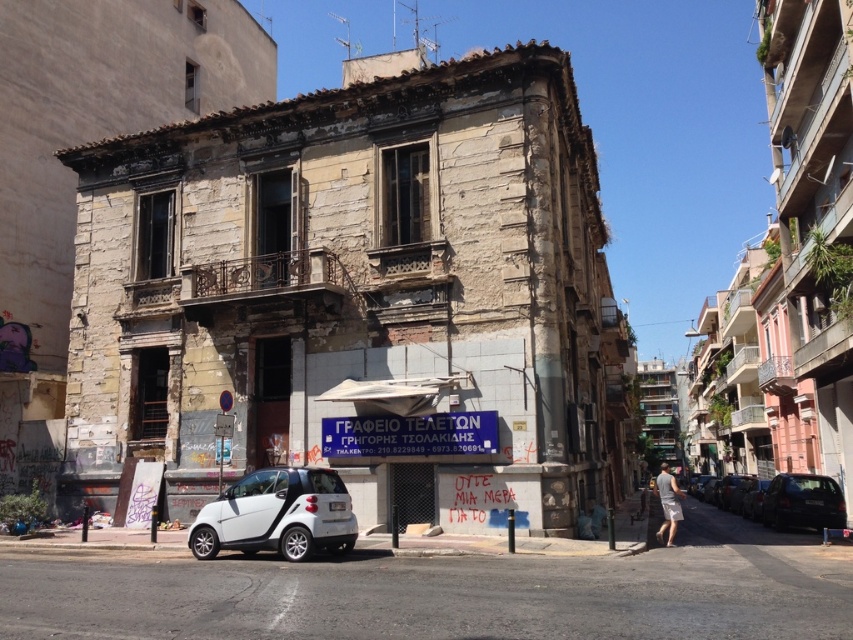
Question: Can you confirm if white matte car at center is positioned to the right of dark gray metallic car at right?

Choices:
 (A) yes
 (B) no

Answer: (B)

Question: Which of the following is the farthest from the observer?

Choices:
 (A) (822, 500)
 (B) (280, 509)

Answer: (A)

Question: Which object appears farthest from the camera in this image?

Choices:
 (A) white matte car at center
 (B) dark gray metallic car at right

Answer: (B)

Question: Is white matte car at center bigger than dark gray metallic car at right?

Choices:
 (A) no
 (B) yes

Answer: (A)

Question: Is white matte car at center to the left of dark gray metallic car at right from the viewer's perspective?

Choices:
 (A) yes
 (B) no

Answer: (A)